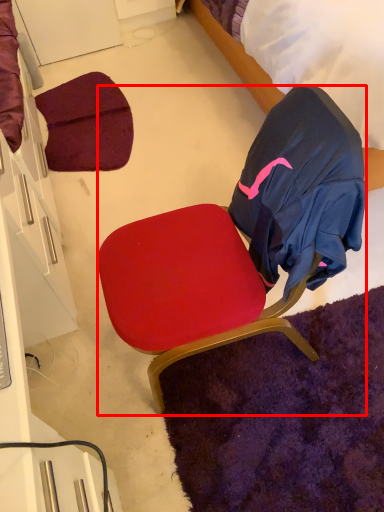
Question: From the image's perspective, where is chair (annotated by the red box) located relative to bed?

Choices:
 (A) above
 (B) below

Answer: (B)